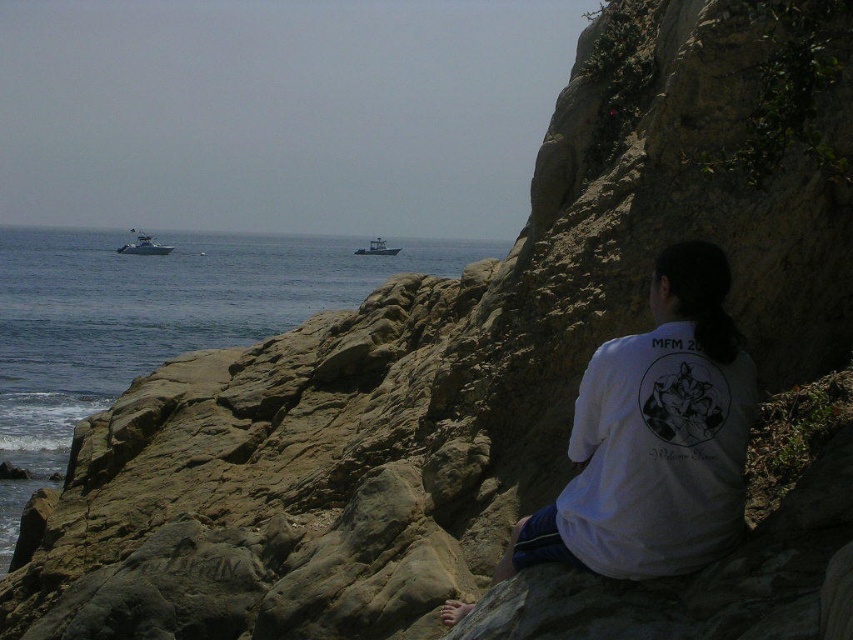
You are standing on the rocky outcrop where the person is sitting. You want to look at the white plastic boat at left without moving your head. Should you look towards the blue water at center or away from it?

The blue water at center is in front of the white plastic boat at left, so to look at the white plastic boat at left without moving your head, you should look away from the blue water at center.

You are a photographer aiming to capture the white cotton shirt at center in your shot. The camera is positioned at the origin point. Based on the coordinates provided, will the shirt be in the upper or lower half of the image?

The white cotton shirt at center is located at coordinates point (654, 436), which places it in the upper half of the image since the y coordinate is above 0.5.